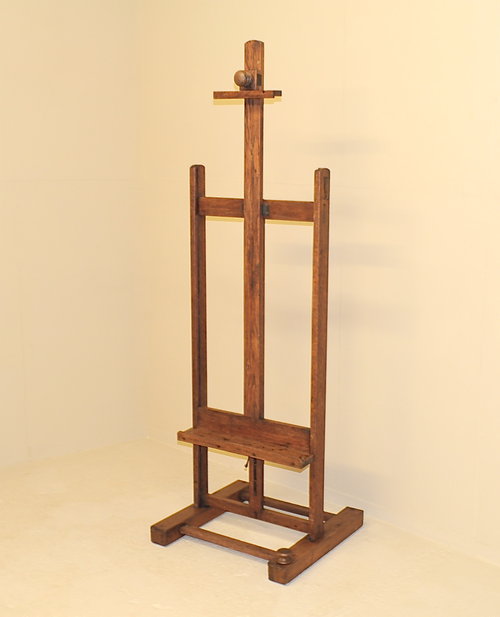
You are a GUI agent. You are given a task and a screenshot of the screen. Output one action in this format:
    pyautogui.click(x=<x>, y=<y>)
    Task: Click on the far right corner
    The image size is (500, 617).
    Given the screenshot: What is the action you would take?
    pyautogui.click(x=362, y=511)